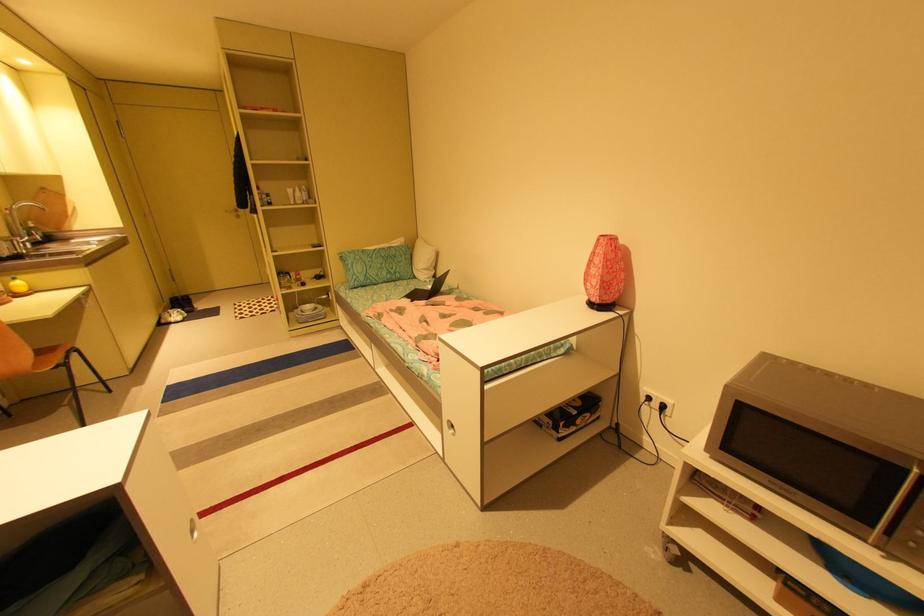
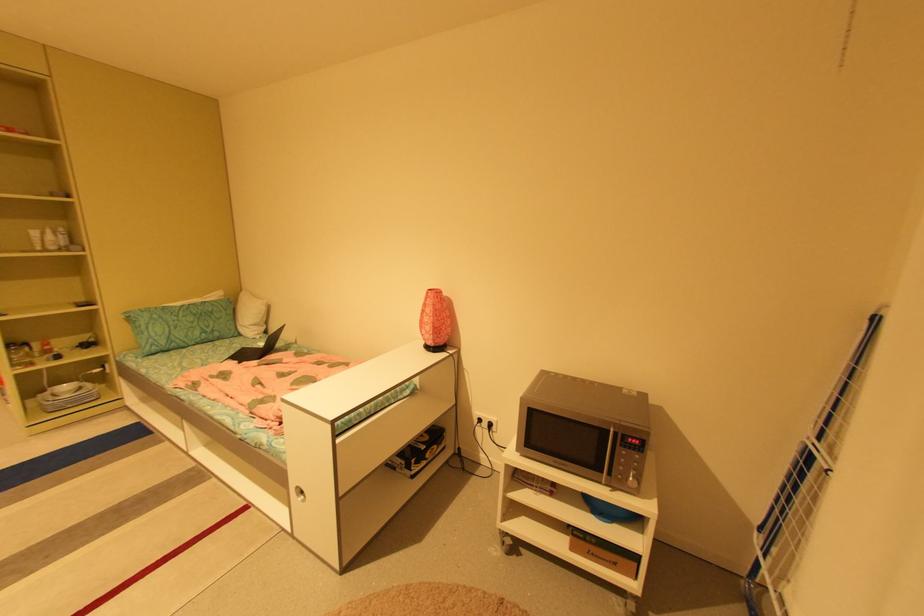
Question: The images are taken continuously from a first-person perspective. In which direction are you moving?

Choices:
 (A) Left
 (B) Right
 (C) Forward
 (D) Backward

Answer: (D)